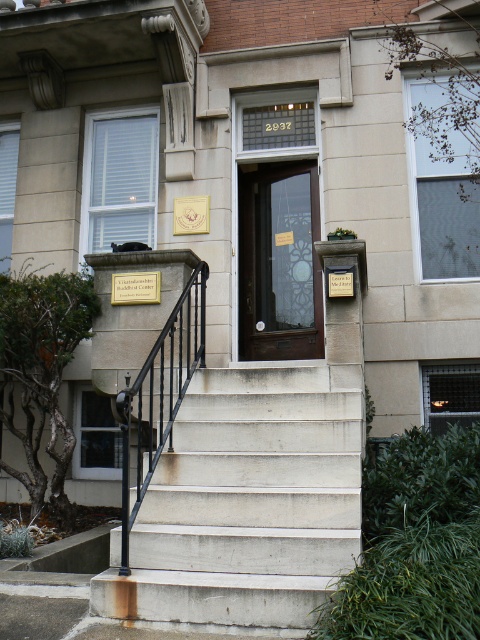
Question: Can you confirm if black wrought iron railing at center is positioned to the right of metallic gold plaque at center?

Choices:
 (A) no
 (B) yes

Answer: (A)

Question: Which point appears farthest from the camera in this image?

Choices:
 (A) (196, 212)
 (B) (178, 365)

Answer: (A)

Question: Does black wrought iron railing at center appear on the right side of gold metallic plaque at center?

Choices:
 (A) no
 (B) yes

Answer: (B)

Question: Which object is farther from the camera taking this photo?

Choices:
 (A) metallic gold plaque at center
 (B) concrete/stained stairs at lower center

Answer: (A)

Question: Which point is farther from the camera taking this photo?

Choices:
 (A) (156, 444)
 (B) (349, 289)
 (C) (120, 288)

Answer: (C)

Question: Can you confirm if brown wooden door at center is positioned above gold metallic plaque at center?

Choices:
 (A) yes
 (B) no

Answer: (A)